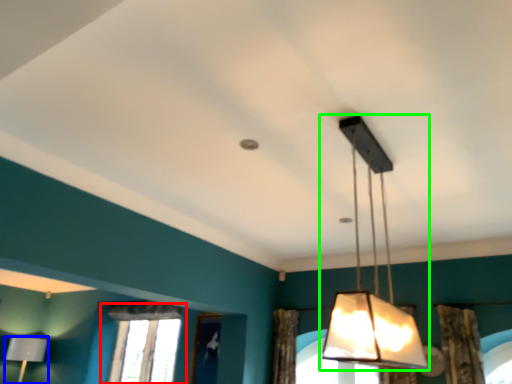
Question: Considering the real-world distances, which object is closest to window (highlighted by a red box)? lamp (highlighted by a blue box) or lamp (highlighted by a green box).

Choices:
 (A) lamp
 (B) lamp

Answer: (A)